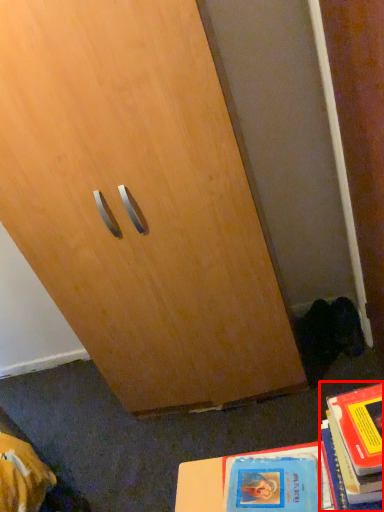
Question: From the image's perspective, what is the correct spatial relationship of book (annotated by the red box) in relation to book?

Choices:
 (A) below
 (B) above

Answer: (B)